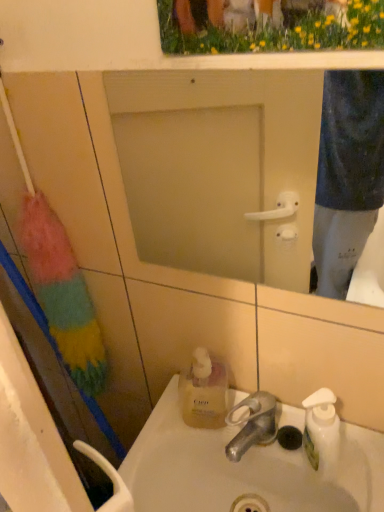
Question: Is silver metallic faucet at sink center turned away from yellow grass at upper center?

Choices:
 (A) no
 (B) yes

Answer: (A)

Question: Is silver metallic faucet at sink center not within yellow grass at upper center?

Choices:
 (A) no
 (B) yes

Answer: (B)

Question: Does silver metallic faucet at sink center come behind yellow grass at upper center?

Choices:
 (A) yes
 (B) no

Answer: (A)

Question: Can you confirm if silver metallic faucet at sink center is positioned to the left of yellow grass at upper center?

Choices:
 (A) yes
 (B) no

Answer: (B)

Question: Considering the relative sizes of silver metallic faucet at sink center and yellow grass at upper center in the image provided, is silver metallic faucet at sink center thinner than yellow grass at upper center?

Choices:
 (A) yes
 (B) no

Answer: (B)

Question: Considering the positions of silver metallic faucet at sink center and yellow grass at upper center in the image, is silver metallic faucet at sink center taller or shorter than yellow grass at upper center?

Choices:
 (A) tall
 (B) short

Answer: (B)

Question: Relative to yellow grass at upper center, is silver metallic faucet at sink center in front or behind?

Choices:
 (A) front
 (B) behind

Answer: (B)

Question: Choose the correct answer: Is silver metallic faucet at sink center inside yellow grass at upper center or outside it?

Choices:
 (A) outside
 (B) inside

Answer: (A)

Question: In terms of width, does silver metallic faucet at sink center look wider or thinner when compared to yellow grass at upper center?

Choices:
 (A) thin
 (B) wide

Answer: (B)

Question: Would you say white glossy sink at center is to the left or to the right of yellow grass at upper center in the picture?

Choices:
 (A) left
 (B) right

Answer: (B)

Question: From a real-world perspective, is white glossy sink at center physically located above or below yellow grass at upper center?

Choices:
 (A) below
 (B) above

Answer: (A)

Question: Looking at their shapes, would you say white glossy sink at center is wider or thinner than yellow grass at upper center?

Choices:
 (A) thin
 (B) wide

Answer: (B)

Question: In terms of height, does white glossy sink at center look taller or shorter compared to yellow grass at upper center?

Choices:
 (A) short
 (B) tall

Answer: (A)

Question: Looking at the image, does frosted glass mirror at center seem bigger or smaller compared to silver metallic faucet at sink center?

Choices:
 (A) small
 (B) big

Answer: (B)

Question: Considering the positions of frosted glass mirror at center and silver metallic faucet at sink center in the image, is frosted glass mirror at center taller or shorter than silver metallic faucet at sink center?

Choices:
 (A) short
 (B) tall

Answer: (B)